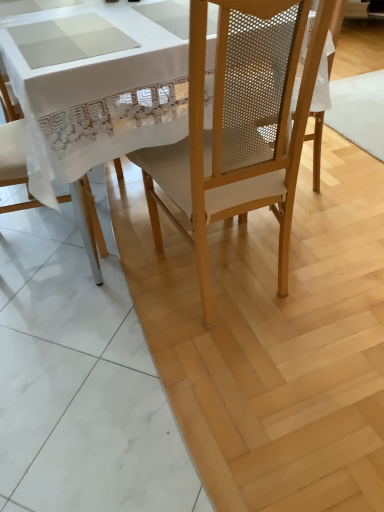
Measure the distance between point (86, 229) and camera.

Point (86, 229) and camera are 5.81 feet apart from each other.

The height and width of the screenshot is (512, 384). Describe the element at coordinates (239, 125) in the screenshot. I see `matte wood chair at center, the 1th chair when ordered from right to left` at that location.

Locate an element on the screen. matte wood chair at center is located at coordinates (273, 338).

At what (x,y) coordinates should I click in order to perform the action: click on white fabric chair at left, acting as the 2th chair starting from the right. Please return your answer as a coordinate pair (x, y). This screenshot has height=512, width=384. Looking at the image, I should click on (11, 143).

From a real-world perspective, is matte wood chair at center, which is counted as the second chair, starting from the left, above or below white fabric chair at left, which ranks as the first chair in left-to-right order?

In terms of real-world spatial position, matte wood chair at center, which is counted as the second chair, starting from the left, is above white fabric chair at left, which ranks as the first chair in left-to-right order.

Which object is closer to the camera, matte wood chair at center, the 1th chair when ordered from right to left, or white fabric chair at left, acting as the 2th chair starting from the right?

Positioned in front is matte wood chair at center, the 1th chair when ordered from right to left.

Can you tell me how much matte wood chair at center, which is counted as the second chair, starting from the left, and white fabric chair at left, which ranks as the first chair in left-to-right order, differ in facing direction?

The facing directions of matte wood chair at center, which is counted as the second chair, starting from the left, and white fabric chair at left, which ranks as the first chair in left-to-right order, are 95.5 degrees apart.

From the image's perspective, between matte wood chair at center, the 1th chair when ordered from right to left, and white fabric chair at left, acting as the 2th chair starting from the right, who is located below?

matte wood chair at center, the 1th chair when ordered from right to left, appears lower in the image.

How different are the orientations of white fabric chair at left, acting as the 2th chair starting from the right, and matte wood chair at center in degrees?

96 degrees.

Is white fabric chair at left, which ranks as the first chair in left-to-right order, at the left side of matte wood chair at center?

Correct, you'll find white fabric chair at left, which ranks as the first chair in left-to-right order, to the left of matte wood chair at center.

Consider the image. Which of these two, white fabric chair at left, acting as the 2th chair starting from the right, or matte wood chair at center, is smaller?

With smaller size is white fabric chair at left, acting as the 2th chair starting from the right.

Consider the image. Looking at their sizes, would you say white fabric chair at left, which ranks as the first chair in left-to-right order, is wider or thinner than matte wood chair at center?

Considering their sizes, white fabric chair at left, which ranks as the first chair in left-to-right order, looks slimmer than matte wood chair at center.

Between matte wood chair at center, the 1th chair when ordered from right to left, and matte wood chair at center, which one appears on the right side from the viewer's perspective?

matte wood chair at center.

Would you consider matte wood chair at center, which is counted as the second chair, starting from the left, to be distant from matte wood chair at center?

No, matte wood chair at center, which is counted as the second chair, starting from the left, is not far from matte wood chair at center.

Would you say matte wood chair at center, the 1th chair when ordered from right to left, is outside matte wood chair at center?

Yes, matte wood chair at center, the 1th chair when ordered from right to left, is outside of matte wood chair at center.

Based on the photo, considering the sizes of objects matte wood chair at center, the 1th chair when ordered from right to left, and matte wood chair at center in the image provided, who is smaller, matte wood chair at center, the 1th chair when ordered from right to left, or matte wood chair at center?

Smaller between the two is matte wood chair at center, the 1th chair when ordered from right to left.

Between matte wood chair at center and white fabric chair at left, which ranks as the first chair in left-to-right order, which one has less height?

With less height is matte wood chair at center.

From the image's perspective, is matte wood chair at center located above white fabric chair at left, which ranks as the first chair in left-to-right order?

Indeed, from the image's perspective, matte wood chair at center is shown above white fabric chair at left, which ranks as the first chair in left-to-right order.

From a real-world perspective, is matte wood chair at center physically located above or below white fabric chair at left, which ranks as the first chair in left-to-right order?

matte wood chair at center is situated lower than white fabric chair at left, which ranks as the first chair in left-to-right order, in the real world.

Consider the image. Does white fabric chair at left, which ranks as the first chair in left-to-right order, turn towards matte wood chair at center, the 1th chair when ordered from right to left?

No, white fabric chair at left, which ranks as the first chair in left-to-right order, is not aimed at matte wood chair at center, the 1th chair when ordered from right to left.

Is matte wood chair at center, which is counted as the second chair, starting from the left, surrounded by white fabric chair at left, acting as the 2th chair starting from the right?

Actually, matte wood chair at center, which is counted as the second chair, starting from the left, is outside white fabric chair at left, acting as the 2th chair starting from the right.

Could you measure the distance between white fabric chair at left, which ranks as the first chair in left-to-right order, and matte wood chair at center, which is counted as the second chair, starting from the left?

white fabric chair at left, which ranks as the first chair in left-to-right order, and matte wood chair at center, which is counted as the second chair, starting from the left, are 26.88 inches apart.

Consider the image. Who is shorter, white fabric chair at left, acting as the 2th chair starting from the right, or matte wood chair at center, which is counted as the second chair, starting from the left?

white fabric chair at left, acting as the 2th chair starting from the right.

Between matte wood chair at center and matte wood chair at center, the 1th chair when ordered from right to left, which one has less height?

With less height is matte wood chair at center.

Is matte wood chair at center positioned with its back to matte wood chair at center, the 1th chair when ordered from right to left?

No.

From the image's perspective, does matte wood chair at center appear higher than matte wood chair at center, which is counted as the second chair, starting from the left?

Yes, from the image's perspective, matte wood chair at center is on top of matte wood chair at center, which is counted as the second chair, starting from the left.

Is point (267, 411) closer or farther from the camera than point (217, 93)?

Point (267, 411) is farther from the camera than point (217, 93).

Identify the location of chair that is on the right side of white fabric chair at left, which ranks as the first chair in left-to-right order. The height and width of the screenshot is (512, 384). (239, 125).

You are a GUI agent. You are given a task and a screenshot of the screen. Output one action in this format:
    pyautogui.click(x=<x>, y=<y>)
    Task: Click on the chair that is the 1st one when counting downward from the matte wood chair at center (from the image's perspective)
    The height and width of the screenshot is (512, 384).
    Given the screenshot: What is the action you would take?
    pyautogui.click(x=11, y=143)

Based on the photo, looking at the image, which one is located further to matte wood chair at center, matte wood chair at center, which is counted as the second chair, starting from the left, or white fabric chair at left, which ranks as the first chair in left-to-right order?

white fabric chair at left, which ranks as the first chair in left-to-right order.

Looking at the image, which one is located further to matte wood chair at center, white fabric chair at left, acting as the 2th chair starting from the right, or matte wood chair at center, which is counted as the second chair, starting from the left?

white fabric chair at left, acting as the 2th chair starting from the right, is further to matte wood chair at center.

Looking at the image, which one is located further to matte wood chair at center, which is counted as the second chair, starting from the left, white fabric chair at left, which ranks as the first chair in left-to-right order, or matte wood chair at center?

The object further to matte wood chair at center, which is counted as the second chair, starting from the left, is white fabric chair at left, which ranks as the first chair in left-to-right order.

When comparing their distances from matte wood chair at center, the 1th chair when ordered from right to left, does matte wood chair at center or white fabric chair at left, acting as the 2th chair starting from the right, seem further?

white fabric chair at left, acting as the 2th chair starting from the right.

Based on their spatial positions, is matte wood chair at center, the 1th chair when ordered from right to left, or matte wood chair at center closer to white fabric chair at left, acting as the 2th chair starting from the right?

matte wood chair at center lies closer to white fabric chair at left, acting as the 2th chair starting from the right, than the other object.

Estimate the real-world distances between objects in this image. Which object is further from white fabric chair at left, which ranks as the first chair in left-to-right order, matte wood chair at center or matte wood chair at center, which is counted as the second chair, starting from the left?

matte wood chair at center, which is counted as the second chair, starting from the left, lies further to white fabric chair at left, which ranks as the first chair in left-to-right order, than the other object.

What are the coordinates of `chair situated between white fabric chair at left, acting as the 2th chair starting from the right, and matte wood chair at center from left to right` in the screenshot? It's located at (239, 125).